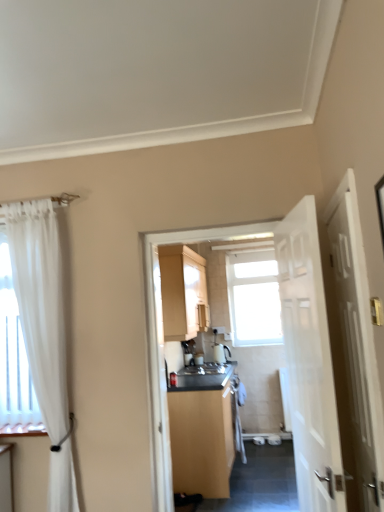
Where is `matte wood cabinet at center, the second cabinetry from the bottom`? matte wood cabinet at center, the second cabinetry from the bottom is located at coordinates (183, 292).

Describe the element at coordinates (309, 362) in the screenshot. I see `white wooden door at right, acting as the second door starting from the right` at that location.

What do you see at coordinates (204, 369) in the screenshot? The image size is (384, 512). I see `white glossy sink at center` at bounding box center [204, 369].

Identify the location of white glossy door at right, the 2th door from the left. (355, 352).

You are a GUI agent. You are given a task and a screenshot of the screen. Output one action in this format:
    pyautogui.click(x=<x>, y=<y>)
    Task: Click on the matte wood cabinet at center, the second cabinetry from the bottom
    The height and width of the screenshot is (512, 384).
    Given the screenshot: What is the action you would take?
    pyautogui.click(x=183, y=292)

Between matte wood cabinet at center, the first cabinetry when ordered from top to bottom, and white sheer curtain at left, which one has less height?

Standing shorter between the two is matte wood cabinet at center, the first cabinetry when ordered from top to bottom.

Can you confirm if matte wood cabinet at center, the first cabinetry when ordered from top to bottom, is positioned to the left of white sheer curtain at left?

No, matte wood cabinet at center, the first cabinetry when ordered from top to bottom, is not to the left of white sheer curtain at left.

Is matte wood cabinet at center, the second cabinetry from the bottom, completely or partially outside of white sheer curtain at left?

matte wood cabinet at center, the second cabinetry from the bottom, is positioned outside white sheer curtain at left.

Locate an element on the screen. The image size is (384, 512). window that appears on the right of white sheer curtain at left is located at coordinates (254, 298).

How far apart are transparent glass window at center and white sheer curtain at left?

A distance of 12.19 feet exists between transparent glass window at center and white sheer curtain at left.

Can you tell me how much transparent glass window at center and white sheer curtain at left differ in facing direction?

transparent glass window at center and white sheer curtain at left are facing 0.902 degrees away from each other.

From the picture: Which object is positioned more to the left, transparent glass window at center or white sheer curtain at left?

From the viewer's perspective, white sheer curtain at left appears more on the left side.

From the image's perspective, is white sheer curtain at left located beneath matte wood cabinet at center, the second cabinetry from the bottom?

Correct, white sheer curtain at left appears lower than matte wood cabinet at center, the second cabinetry from the bottom, in the image.

You are a GUI agent. You are given a task and a screenshot of the screen. Output one action in this format:
    pyautogui.click(x=<x>, y=<y>)
    Task: Click on the cabinetry above the white sheer curtain at left (from the image's perspective)
    
    Given the screenshot: What is the action you would take?
    click(183, 292)

From the image's perspective, is matte wood cabinet at center, which is counted as the second cabinetry, starting from the top, above or below transparent glass window at center?

From the image's perspective, matte wood cabinet at center, which is counted as the second cabinetry, starting from the top, appears below transparent glass window at center.

Is matte wood cabinet at center, which is counted as the second cabinetry, starting from the top, oriented towards transparent glass window at center?

No.

Is matte wood cabinet at center, which is counted as the second cabinetry, starting from the top, not near transparent glass window at center?

Absolutely, matte wood cabinet at center, which is counted as the second cabinetry, starting from the top, is distant from transparent glass window at center.

Find the location of `sink that is in front of the transparent glass window at center`. sink that is in front of the transparent glass window at center is located at coordinates (204, 369).

Is white glossy sink at center turned away from transparent glass window at center?

No, white glossy sink at center is not facing away from transparent glass window at center.

Does white glossy sink at center have a larger size compared to transparent glass window at center?

No.

Can you confirm if matte wood cabinet at center, the second cabinetry from the bottom, is thinner than matte wood cabinet at center, which is counted as the second cabinetry, starting from the top?

Indeed, matte wood cabinet at center, the second cabinetry from the bottom, has a lesser width compared to matte wood cabinet at center, which is counted as the second cabinetry, starting from the top.

How distant is matte wood cabinet at center, the first cabinetry when ordered from top to bottom, from matte wood cabinet at center, which is counted as the second cabinetry, starting from the top?

They are 32.17 inches apart.

Is matte wood cabinet at center, the first cabinetry when ordered from top to bottom, far away from matte wood cabinet at center, which is the first cabinetry in bottom-to-top order?

No, matte wood cabinet at center, the first cabinetry when ordered from top to bottom, is in close proximity to matte wood cabinet at center, which is the first cabinetry in bottom-to-top order.

In the image, is matte wood cabinet at center, the first cabinetry when ordered from top to bottom, positioned in front of or behind matte wood cabinet at center, which is counted as the second cabinetry, starting from the top?

matte wood cabinet at center, the first cabinetry when ordered from top to bottom, is positioned farther from the viewer than matte wood cabinet at center, which is counted as the second cabinetry, starting from the top.

Is the position of white sheer curtain at left more distant than that of white glossy door at right, the 2th door from the left?

Yes, the depth of white sheer curtain at left is greater than that of white glossy door at right, the 2th door from the left.

From a real-world perspective, which is physically above, white sheer curtain at left or white glossy door at right, arranged as the first door when viewed from the right?

From a 3D spatial view, white sheer curtain at left is above.

Between white sheer curtain at left and white glossy door at right, the 2th door from the left, which one has smaller size?

With smaller size is white glossy door at right, the 2th door from the left.

The width and height of the screenshot is (384, 512). Identify the location of cabinetry located above the white sheer curtain at left (from the image's perspective). (183, 292).

This screenshot has width=384, height=512. Identify the location of window that appears above the white sheer curtain at left (from a real-world perspective). (254, 298).

Looking at the image, which one is located further to white glossy sink at center, white glossy door at right, the 2th door from the left, or white sheer curtain at left?

Among the two, white glossy door at right, the 2th door from the left, is located further to white glossy sink at center.

Which object lies further to the anchor point white wooden door at right, the first door positioned from the left, matte wood cabinet at center, the first cabinetry when ordered from top to bottom, or transparent glass window at center?

transparent glass window at center is further to white wooden door at right, the first door positioned from the left.

Looking at the image, which one is located further to matte wood cabinet at center, which is the first cabinetry in bottom-to-top order, white sheer curtain at left or white glossy door at right, arranged as the first door when viewed from the right?

white glossy door at right, arranged as the first door when viewed from the right, is further to matte wood cabinet at center, which is the first cabinetry in bottom-to-top order.

Which object lies further to the anchor point white glossy sink at center, white wooden door at right, acting as the second door starting from the right, or white glossy door at right, arranged as the first door when viewed from the right?

white glossy door at right, arranged as the first door when viewed from the right, is positioned further to the anchor white glossy sink at center.

From the image, which object appears to be farther from matte wood cabinet at center, the first cabinetry when ordered from top to bottom, white glossy sink at center or white glossy door at right, the 2th door from the left?

white glossy door at right, the 2th door from the left.

Which object lies nearer to the anchor point transparent glass window at center, white glossy door at right, arranged as the first door when viewed from the right, or white wooden door at right, acting as the second door starting from the right?

Based on the image, white wooden door at right, acting as the second door starting from the right, appears to be nearer to transparent glass window at center.

Considering their positions, is white glossy sink at center positioned further to white wooden door at right, acting as the second door starting from the right, than transparent glass window at center?

transparent glass window at center.

Estimate the real-world distances between objects in this image. Which object is further from white wooden door at right, acting as the second door starting from the right, white glossy door at right, the 2th door from the left, or matte wood cabinet at center, the first cabinetry when ordered from top to bottom?

matte wood cabinet at center, the first cabinetry when ordered from top to bottom, is positioned further to the anchor white wooden door at right, acting as the second door starting from the right.

At what (x,y) coordinates should I click in order to perform the action: click on door between white glossy door at right, the 2th door from the left, and transparent glass window at center, along the z-axis. Please return your answer as a coordinate pair (x, y). Looking at the image, I should click on (309, 362).

Where is `door situated between white sheer curtain at left and white glossy door at right, arranged as the first door when viewed from the right, from left to right`? This screenshot has width=384, height=512. door situated between white sheer curtain at left and white glossy door at right, arranged as the first door when viewed from the right, from left to right is located at coordinates (309, 362).

At what (x,y) coordinates should I click in order to perform the action: click on sink located between white sheer curtain at left and transparent glass window at center in the depth direction. Please return your answer as a coordinate pair (x, y). The width and height of the screenshot is (384, 512). Looking at the image, I should click on coord(204,369).

I want to click on sink located between matte wood cabinet at center, the first cabinetry when ordered from top to bottom, and transparent glass window at center in the depth direction, so click(204, 369).